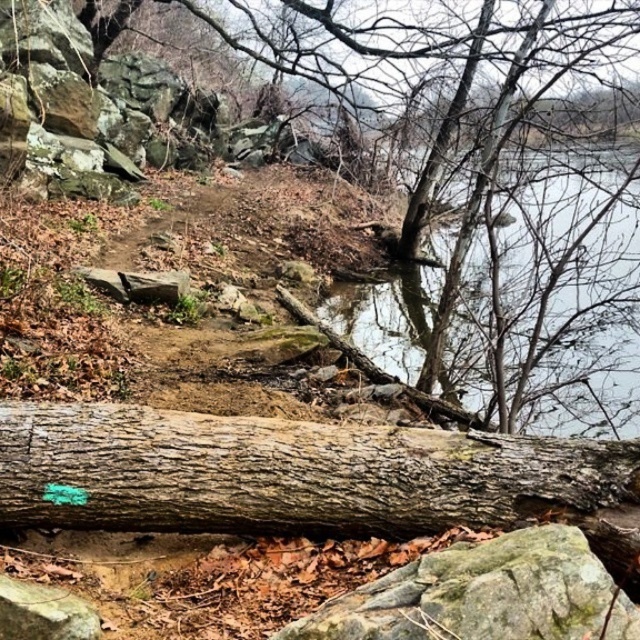
You are standing at the base of the large fallen tree trunk in the image and want to walk towards the point labeled as point (579,548). Which direction should you move relative to the point labeled point (429,330)?

You should move away from point (429,330) because point (579,548) is further away from the viewer than point (429,330).

You are a hiker carrying a heavy backpack and need to cross the clear water at center and the green mossy rock at lower center. Which one do you think is wider to walk on?

The clear water at center is wider than the green mossy rock at lower center, so you can walk on the clear water at center more comfortably.

You are a hiker trying to cross the clear water at center. There is a green mossy rock at lower center nearby. Which direction should you move to reach the rock from the water?

The clear water at center is above the green mossy rock at lower center, so you should move downward to reach the rock from the water.